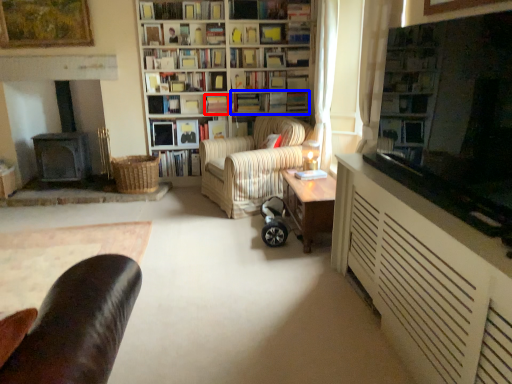
Question: Among these objects, which one is nearest to the camera, book (highlighted by a red box) or book (highlighted by a blue box)?

Choices:
 (A) book
 (B) book

Answer: (A)